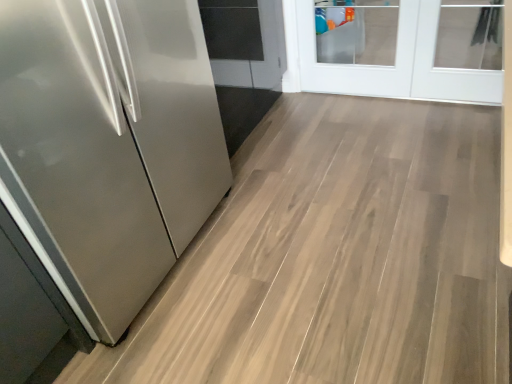
Locate an element on the screen. free point to the right of satin stainless steel refrigerator at left is located at coordinates (296, 228).